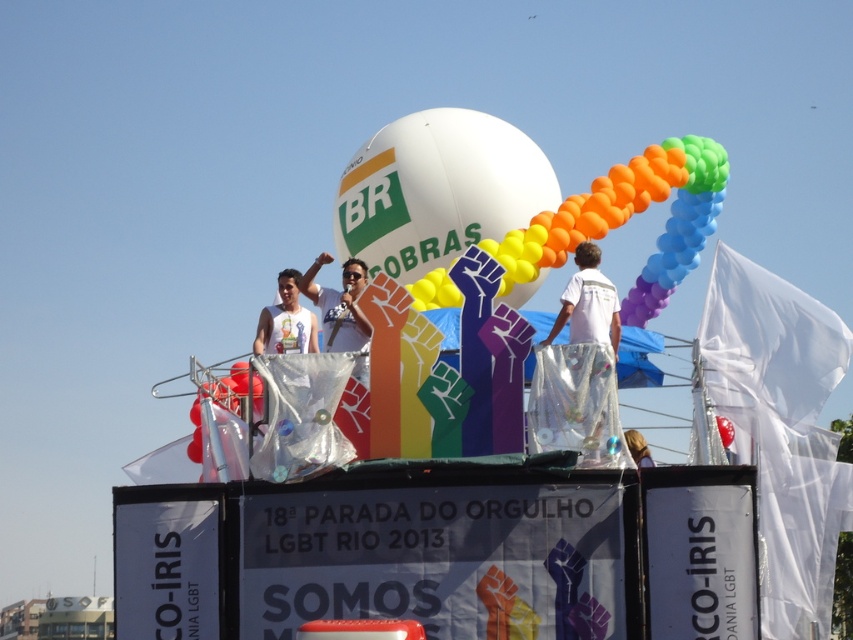
Question: Is rainbow balloons at center smaller than white shiny pants at center?

Choices:
 (A) yes
 (B) no

Answer: (B)

Question: In this image, where is rainbow balloons at center located relative to white shiny pants at center?

Choices:
 (A) right
 (B) left

Answer: (A)

Question: Does rainbow balloons at center appear on the right side of white matte tank top at center?

Choices:
 (A) yes
 (B) no

Answer: (A)

Question: Which point appears farthest from the camera in this image?

Choices:
 (A) (596, 332)
 (B) (648, 192)
 (C) (311, 344)

Answer: (B)

Question: Which object is positioned closest to the white matte tank top at center?

Choices:
 (A) rainbow balloons at center
 (B) white shiny pants at center

Answer: (B)

Question: Which point is closer to the camera taking this photo?

Choices:
 (A) (573, 339)
 (B) (311, 320)
 (C) (622, 218)

Answer: (A)